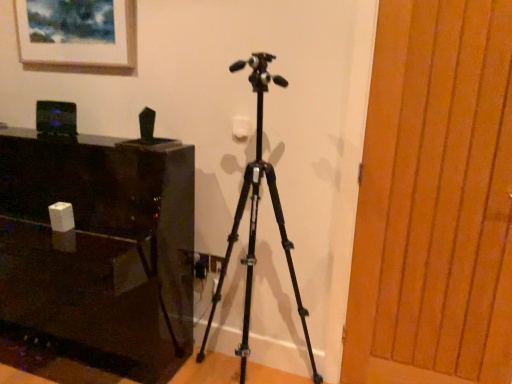
The image size is (512, 384). Identify the location of black matte tripod at center. (256, 218).

Based on the photo, in order to face matte wooden picture frame at upper left, should I rotate leftwards or rightwards?

A 23.401 degree turn to the left will do.

This screenshot has width=512, height=384. Describe the element at coordinates (435, 200) in the screenshot. I see `wooden door at right` at that location.

Identify the location of black matte tripod at center. (256, 218).

Who is smaller, glossy black table at left or black matte tripod at center?

Smaller between the two is black matte tripod at center.

Is point (23, 293) farther from viewer compared to point (263, 169)?

Yes, it is.

Is glossy black table at left taller or shorter than black matte tripod at center?

In the image, glossy black table at left appears to be shorter than black matte tripod at center.

Measure the distance between glossy black table at left and black matte tripod at center.

The distance of glossy black table at left from black matte tripod at center is 20.48 inches.

In the scene shown: From their relative heights in the image, would you say black matte tripod at center is taller or shorter than matte wooden picture frame at upper left?

In the image, black matte tripod at center appears to be taller than matte wooden picture frame at upper left.

From a real-world perspective, does black matte tripod at center stand above matte wooden picture frame at upper left?

Incorrect, from a real-world perspective, black matte tripod at center is lower than matte wooden picture frame at upper left.

Is black matte tripod at center next to matte wooden picture frame at upper left?

No, black matte tripod at center is not touching matte wooden picture frame at upper left.

I want to click on glass door below the matte wooden picture frame at upper left (from a real-world perspective), so click(x=435, y=200).

From a real-world perspective, does wooden door at right sit lower than matte wooden picture frame at upper left?

Indeed, from a real-world perspective, wooden door at right is positioned beneath matte wooden picture frame at upper left.

Based on the photo, is the depth of wooden door at right greater than that of matte wooden picture frame at upper left?

No, it is not.

Is wooden door at right next to matte wooden picture frame at upper left?

No, wooden door at right is not in contact with matte wooden picture frame at upper left.

Based on the photo, is matte wooden picture frame at upper left positioned far away from glossy black table at left?

No, matte wooden picture frame at upper left is not far away from glossy black table at left.

How different are the orientations of matte wooden picture frame at upper left and glossy black table at left in degrees?

matte wooden picture frame at upper left and glossy black table at left are facing 1.95 degrees away from each other.

From a real-world perspective, relative to glossy black table at left, is matte wooden picture frame at upper left vertically above or below?

matte wooden picture frame at upper left is above glossy black table at left.

Which of these two, matte wooden picture frame at upper left or glossy black table at left, is thinner?

Thinner between the two is matte wooden picture frame at upper left.

Does glossy black table at left have a smaller size compared to matte wooden picture frame at upper left?

No.

Is glossy black table at left with matte wooden picture frame at upper left?

No, glossy black table at left is not touching matte wooden picture frame at upper left.

From the image's perspective, is glossy black table at left over matte wooden picture frame at upper left?

No.

Which object is wider, glossy black table at left or matte wooden picture frame at upper left?

glossy black table at left.

Does point (412, 211) come farther from viewer compared to point (49, 296)?

No, (412, 211) is closer to viewer.

From a real-world perspective, who is located higher, wooden door at right or glossy black table at left?

In real-world perspective, wooden door at right is above.

Can you tell me how much wooden door at right and glossy black table at left differ in facing direction?

wooden door at right and glossy black table at left are facing 1.95 degrees away from each other.

Considering the relative sizes of wooden door at right and glossy black table at left in the image provided, is wooden door at right thinner than glossy black table at left?

Yes.

Is black matte tripod at center at the back of wooden door at right?

wooden door at right is not turned away from black matte tripod at center.

Based on the photo, is wooden door at right positioned in front of black matte tripod at center?

No, it is behind black matte tripod at center.

Which is farther from the camera, [490,216] or [297,293]?

The point [297,293] is farther from the camera.

Is wooden door at right far away from black matte tripod at center?

wooden door at right is near black matte tripod at center, not far away.

This screenshot has height=384, width=512. Identify the location of tripod on the right side of glossy black table at left. (256, 218).

Locate an element on the screen. picture frame that appears behind the black matte tripod at center is located at coordinates (82, 42).

Looking at the image, which one is located further to glossy black table at left, matte wooden picture frame at upper left or wooden door at right?

wooden door at right is further to glossy black table at left.

Estimate the real-world distances between objects in this image. Which object is further from glossy black table at left, matte wooden picture frame at upper left or black matte tripod at center?

Among the two, matte wooden picture frame at upper left is located further to glossy black table at left.

When comparing their distances from black matte tripod at center, does matte wooden picture frame at upper left or glossy black table at left seem closer?

The object closer to black matte tripod at center is glossy black table at left.

Estimate the real-world distances between objects in this image. Which object is closer to glossy black table at left, wooden door at right or matte wooden picture frame at upper left?

matte wooden picture frame at upper left is closer to glossy black table at left.

Looking at this image, estimate the real-world distances between objects in this image. Which object is further from black matte tripod at center, wooden door at right or matte wooden picture frame at upper left?

matte wooden picture frame at upper left lies further to black matte tripod at center than the other object.

Considering their positions, is glossy black table at left positioned further to wooden door at right than matte wooden picture frame at upper left?

matte wooden picture frame at upper left is further to wooden door at right.

From the image, which object appears to be farther from matte wooden picture frame at upper left, black matte tripod at center or wooden door at right?

wooden door at right lies further to matte wooden picture frame at upper left than the other object.

Which object lies nearer to the anchor point glossy black table at left, wooden door at right or black matte tripod at center?

The object closer to glossy black table at left is black matte tripod at center.

Locate an element on the screen. This screenshot has height=384, width=512. tripod located between glossy black table at left and wooden door at right in the left-right direction is located at coordinates (256, 218).

Identify the location of tripod between matte wooden picture frame at upper left and wooden door at right. The image size is (512, 384). (256, 218).

You are a GUI agent. You are given a task and a screenshot of the screen. Output one action in this format:
    pyautogui.click(x=<x>, y=<y>)
    Task: Click on the picture frame between glossy black table at left and wooden door at right
    The image size is (512, 384).
    Given the screenshot: What is the action you would take?
    pyautogui.click(x=82, y=42)

Image resolution: width=512 pixels, height=384 pixels. I want to click on tripod that lies between matte wooden picture frame at upper left and glossy black table at left from top to bottom, so click(256, 218).